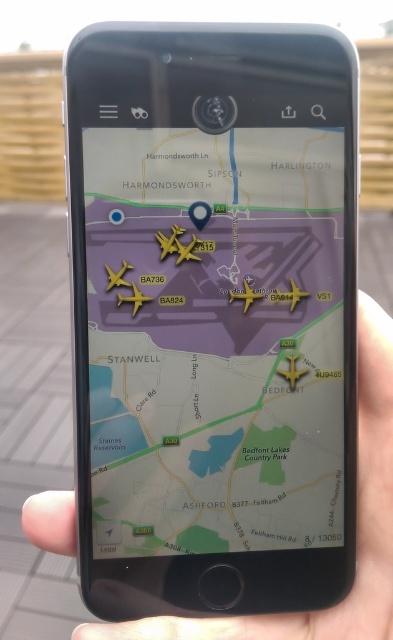
Question: Can you confirm if black matte smartphone at center is positioned below matte gold airplane at center?

Choices:
 (A) no
 (B) yes

Answer: (A)

Question: Does black matte smartphone at center lie in front of matte gold airplane at center?

Choices:
 (A) no
 (B) yes

Answer: (A)

Question: Which object appears farthest from the camera in this image?

Choices:
 (A) matte gold airplane at center
 (B) black matte smartphone at center

Answer: (B)

Question: Does black matte smartphone at center come behind matte gold airplane at center?

Choices:
 (A) yes
 (B) no

Answer: (A)

Question: Which object appears closest to the camera in this image?

Choices:
 (A) black matte smartphone at center
 (B) matte gold airplane at center

Answer: (B)